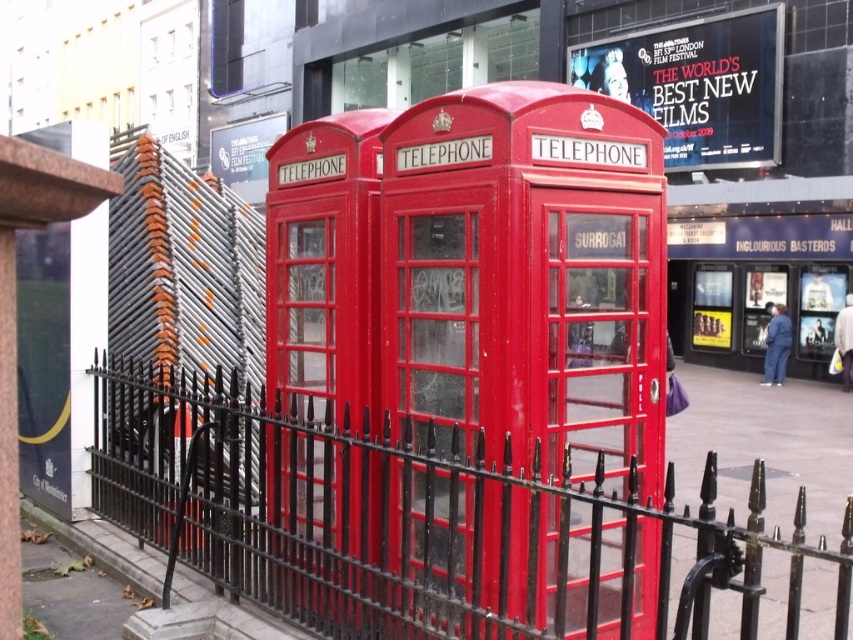
Who is more distant from viewer, (524,182) or (410,557)?

The point (410,557) is more distant.

Is matte red telephone booth at center positioned at the back of black wrought iron fence at lower left?

Yes, it is behind black wrought iron fence at lower left.

Measure the distance between matte red telephone booth at center and camera.

They are 9.20 feet apart.

The width and height of the screenshot is (853, 640). What are the coordinates of `matte red telephone booth at center` in the screenshot? It's located at (527, 282).